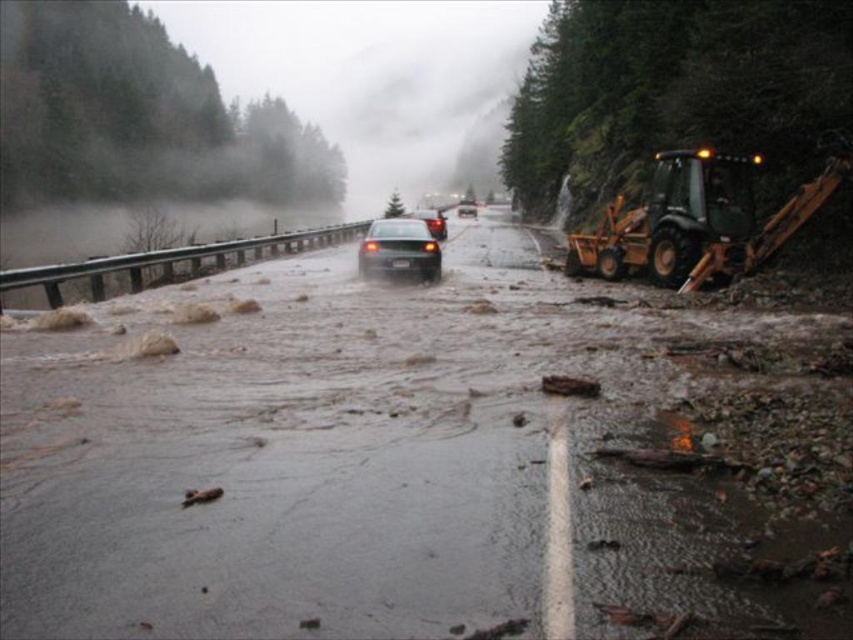
Consider the image. Does brown muddy water at center appear on the right side of black rubber car at center?

Yes, brown muddy water at center is to the right of black rubber car at center.

Looking at this image, does brown muddy water at center have a smaller size compared to black rubber car at center?

Yes.

This screenshot has width=853, height=640. In order to click on brown muddy water at center in this screenshot , I will do `click(339, 454)`.

Does brown muddy water at center have a greater height compared to green rubber excavator at right?

In fact, brown muddy water at center may be shorter than green rubber excavator at right.

At what (x,y) coordinates should I click in order to perform the action: click on brown muddy water at center. Please return your answer as a coordinate pair (x, y). Looking at the image, I should click on (339, 454).

Which is behind, point (415, 336) or point (752, 189)?

Positioned behind is point (752, 189).

The height and width of the screenshot is (640, 853). What are the coordinates of `brown muddy water at center` in the screenshot? It's located at (339, 454).

Can you confirm if black rubber car at center is positioned to the right of glossy black sedan at center?

Incorrect, black rubber car at center is not on the right side of glossy black sedan at center.

Does point (434, 220) lie in front of point (462, 204)?

Yes, point (434, 220) is in front of point (462, 204).

At what (x,y) coordinates should I click in order to perform the action: click on black rubber car at center. Please return your answer as a coordinate pair (x, y). Looking at the image, I should click on (432, 221).